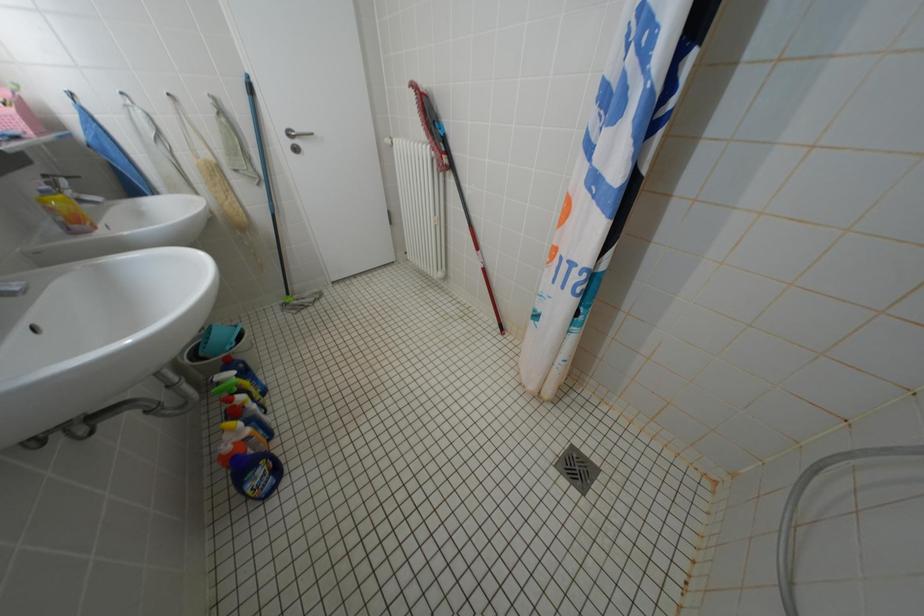
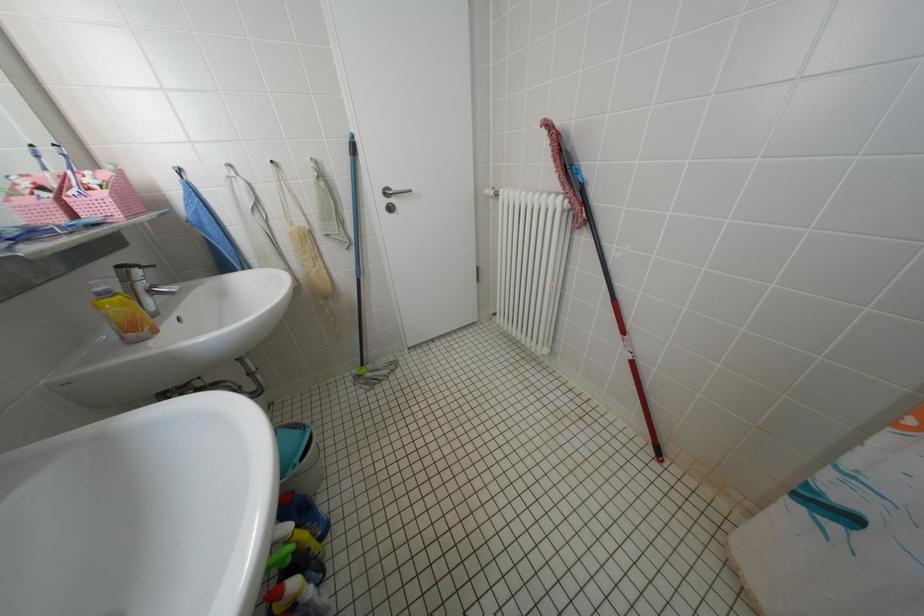
The images are taken continuously from a first-person perspective. In which direction are you moving?

The movement direction of the cameraman is left, forward.